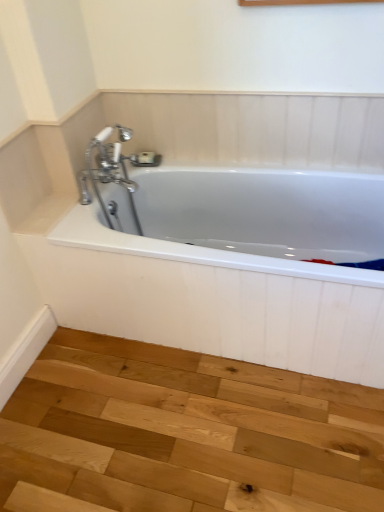
Where is `free space above natural wood stair at lower left (from a real-world perspective)`? The width and height of the screenshot is (384, 512). free space above natural wood stair at lower left (from a real-world perspective) is located at coordinates (167, 425).